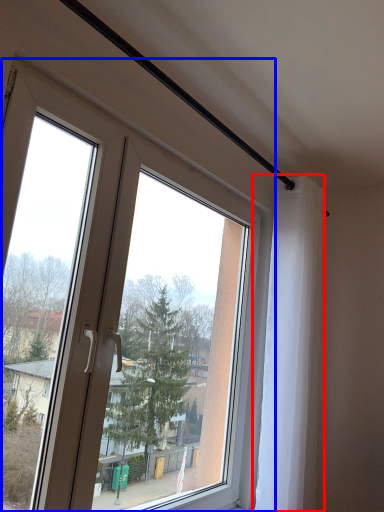
Question: Which object is further to the camera taking this photo, curtain (highlighted by a red box) or window (highlighted by a blue box)?

Choices:
 (A) curtain
 (B) window

Answer: (A)